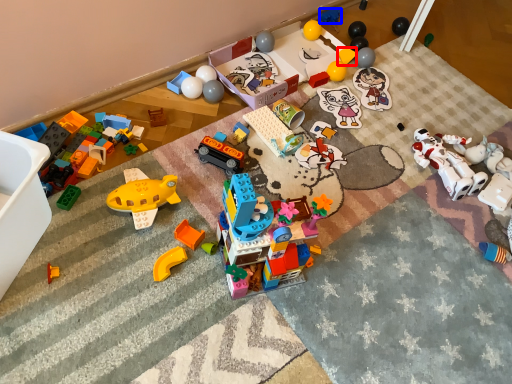
Question: Which of the following is the farthest to the observer, toy (highlighted by a red box) or toy (highlighted by a blue box)?

Choices:
 (A) toy
 (B) toy

Answer: (B)